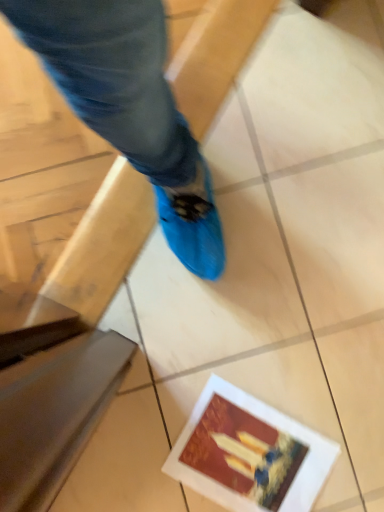
I want to click on vacant space to the left of matte paper postcard at lower right, so click(148, 422).